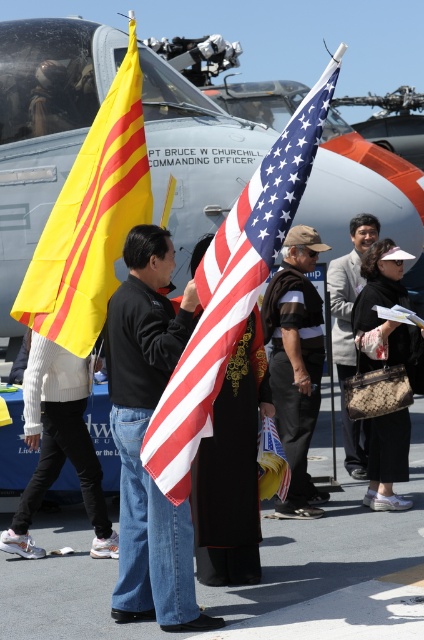
Question: Which object appears farthest from the camera in this image?

Choices:
 (A) khaki fabric cap at center
 (B) yellowmaterial/textureflag at left
 (C) light brown leather jacket at center
 (D) denim jeans at center

Answer: (C)

Question: Which point is closer to the camera?

Choices:
 (A) light brown leather jacket at center
 (B) black textured bag at center

Answer: (B)

Question: Is metallic gray aircraft at center above denim jeans at center?

Choices:
 (A) no
 (B) yes

Answer: (B)

Question: Does american flag at center have a greater width compared to khaki fabric cap at center?

Choices:
 (A) yes
 (B) no

Answer: (A)

Question: In this image, where is denim jeans at center located relative to yellowmaterial/textureflag at left?

Choices:
 (A) below
 (B) above

Answer: (A)

Question: Which point is closer to the camera taking this photo?

Choices:
 (A) (234, 224)
 (B) (273, 284)

Answer: (A)